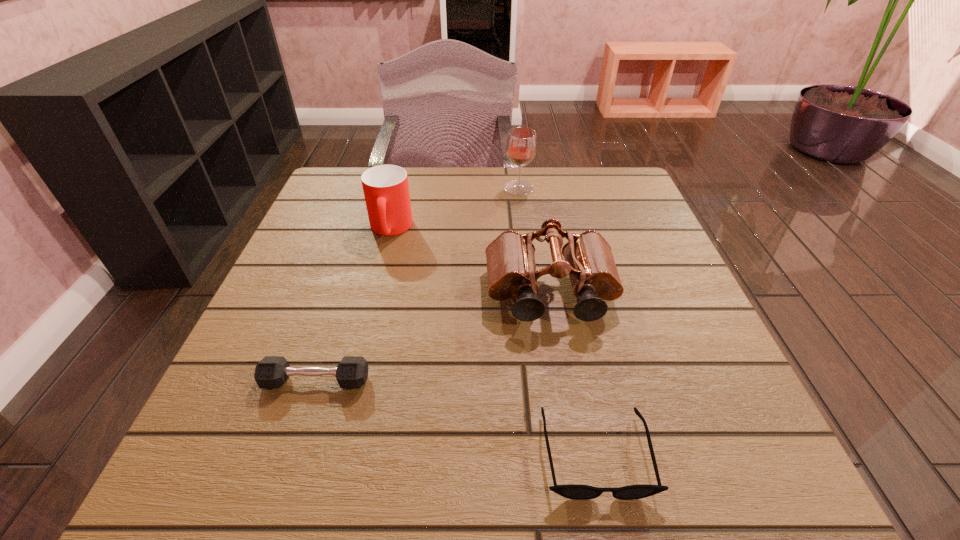
Where is `the farthest object`? Image resolution: width=960 pixels, height=540 pixels. the farthest object is located at coordinates (521, 146).

Where is `the tallest object`? This screenshot has height=540, width=960. the tallest object is located at coordinates (521, 146).

Where is `the fourth nearest object`? the fourth nearest object is located at coordinates (386, 190).

The height and width of the screenshot is (540, 960). In order to click on binoculars in this screenshot , I will do `click(511, 269)`.

Find the location of a particular element. the fourth tallest object is located at coordinates (271, 372).

Where is `dumbbell`? dumbbell is located at coordinates (271, 372).

Where is `sunglasses`? The height and width of the screenshot is (540, 960). sunglasses is located at coordinates (573, 491).

Identify the location of the shortest object. The image size is (960, 540). (573, 491).

Locate an element on the screen. This screenshot has height=540, width=960. vacant space located on the left of the tallest object is located at coordinates (347, 188).

The image size is (960, 540). Find the location of `vacant region located on the side of the cup with the handle`. vacant region located on the side of the cup with the handle is located at coordinates (363, 338).